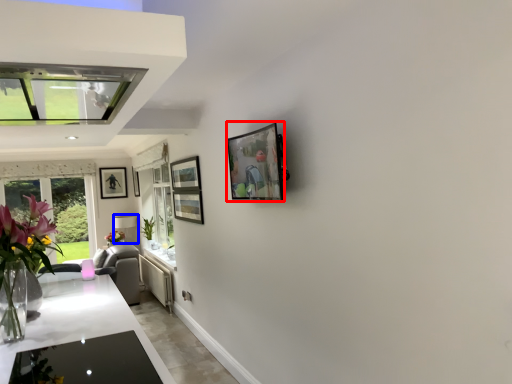
Question: Which object appears closest to the camera in this image, picture frame (highlighted by a red box) or lamp (highlighted by a blue box)?

Choices:
 (A) picture frame
 (B) lamp

Answer: (A)